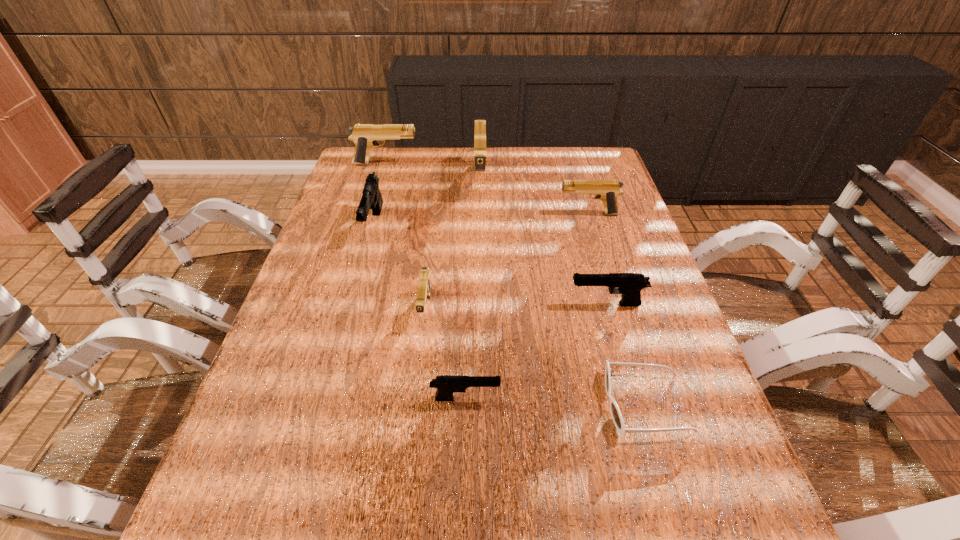
Identify the location of vacant area located at the barrel of the rightmost tan pistol. The image size is (960, 540). (508, 214).

Where is `vacant region located 0.120m on the front-facing side of the second biggest black pistol`? The height and width of the screenshot is (540, 960). vacant region located 0.120m on the front-facing side of the second biggest black pistol is located at coordinates (518, 304).

The width and height of the screenshot is (960, 540). Identify the location of free space located 0.170m on the front-facing side of the second biggest black pistol. (497, 304).

The height and width of the screenshot is (540, 960). Find the location of `free region located on the front-facing side of the second biggest black pistol`. free region located on the front-facing side of the second biggest black pistol is located at coordinates (455, 304).

Find the location of a particular element. Image resolution: width=960 pixels, height=540 pixels. free space located at the barrel of the smallest tan pistol is located at coordinates (412, 418).

Where is `vacant space located on the front-facing side of the smallest black pistol`? vacant space located on the front-facing side of the smallest black pistol is located at coordinates (657, 399).

You are a GUI agent. You are given a task and a screenshot of the screen. Output one action in this format:
    pyautogui.click(x=<x>, y=<y>)
    Task: Click on the free space located 0.380m with the lenses of the shortest object facing outward
    This screenshot has width=960, height=540.
    Given the screenshot: What is the action you would take?
    (411, 404)

At what (x,y) coordinates should I click in order to perform the action: click on free region located with the lenses of the shortest object facing outward. Please return your answer as a coordinate pair (x, y). Looking at the image, I should click on (446, 404).

What are the coordinates of `vacant space located 0.380m with the lenses of the shortest object facing outward` in the screenshot? It's located at (411, 404).

Identify the location of sunglasses at the right edge. Image resolution: width=960 pixels, height=540 pixels. (617, 418).